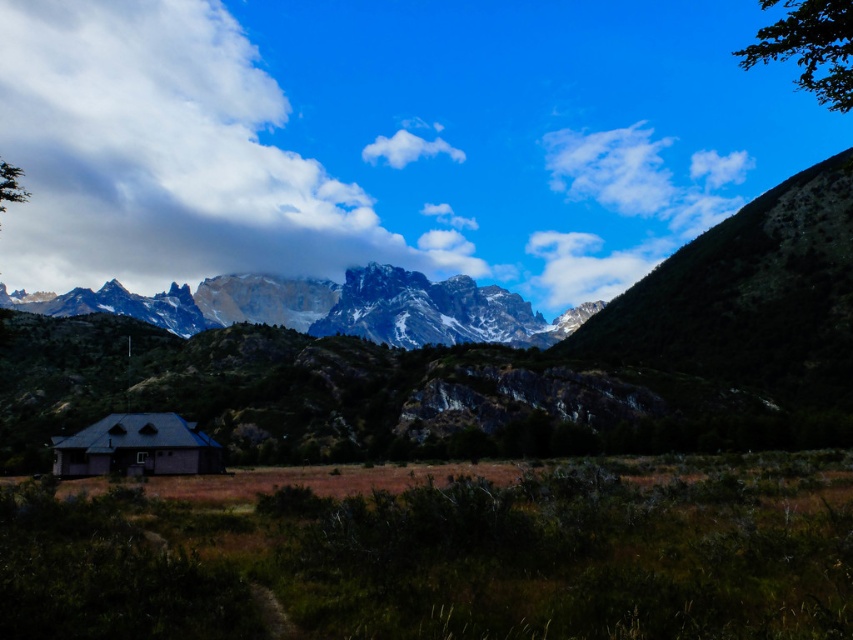
In the scene shown: Measure the distance between green leafy tree at upper right and white fluffy cloud at upper center.

The distance of green leafy tree at upper right from white fluffy cloud at upper center is 337.56 meters.

Between green leafy tree at upper right and white fluffy cloud at upper center, which one appears on the right side from the viewer's perspective?

green leafy tree at upper right is more to the right.

Is point (817, 93) farther from camera compared to point (438, 124)?

No, it is not.

The width and height of the screenshot is (853, 640). What are the coordinates of `green leafy tree at upper right` in the screenshot? It's located at (811, 48).

Which is more to the right, cloudy white at upper center or green leafy tree at upper right?

green leafy tree at upper right is more to the right.

Is cloudy white at upper center further to camera compared to green leafy tree at upper right?

Yes, it is.

Does point (277, 268) come in front of point (842, 38)?

No, it is behind (842, 38).

I want to click on cloudy white at upper center, so click(172, 157).

Which is below, cloudy white at upper center or gray wooden cabin at lower left?

gray wooden cabin at lower left is lower down.

The height and width of the screenshot is (640, 853). Describe the element at coordinates (172, 157) in the screenshot. I see `cloudy white at upper center` at that location.

You are a GUI agent. You are given a task and a screenshot of the screen. Output one action in this format:
    pyautogui.click(x=<x>, y=<y>)
    Task: Click on the cloudy white at upper center
    This screenshot has height=640, width=853.
    Given the screenshot: What is the action you would take?
    pyautogui.click(x=172, y=157)